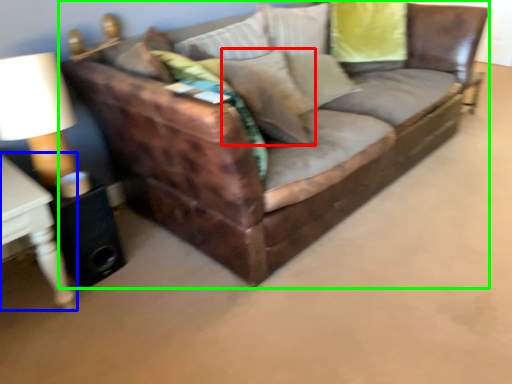
Question: Which object is the closest to the pillow (highlighted by a red box)? Choose among these: table (highlighted by a blue box) or studio couch (highlighted by a green box).

Choices:
 (A) table
 (B) studio couch

Answer: (B)